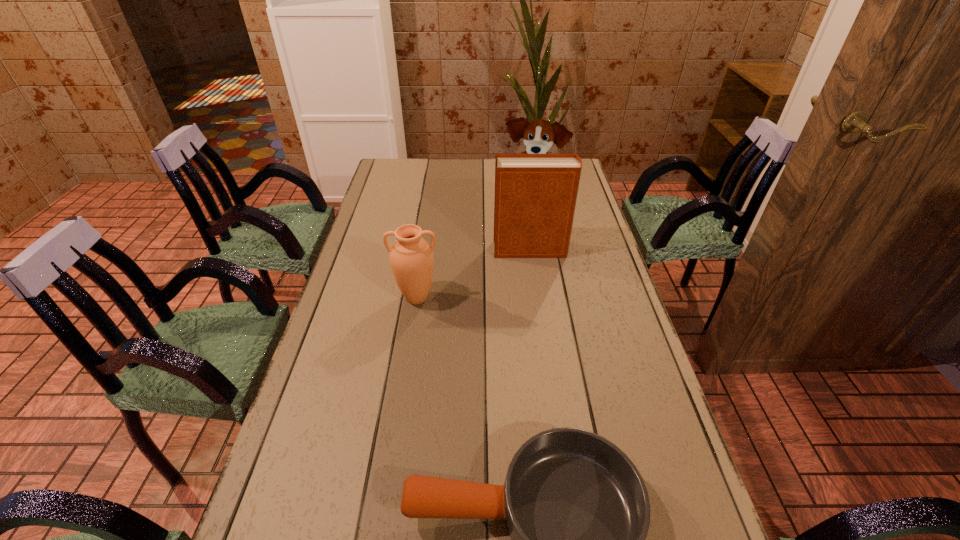
In order to click on vacant point that satisfies the following two spatial constraints: 1. on the face of the farthest object; 2. on the open cover of the second farthest object in this screenshot , I will do `click(540, 250)`.

This screenshot has width=960, height=540. I want to click on free location that satisfies the following two spatial constraints: 1. on the open cover of the hardback book; 2. on the front side of the second nearest object, so click(x=538, y=298).